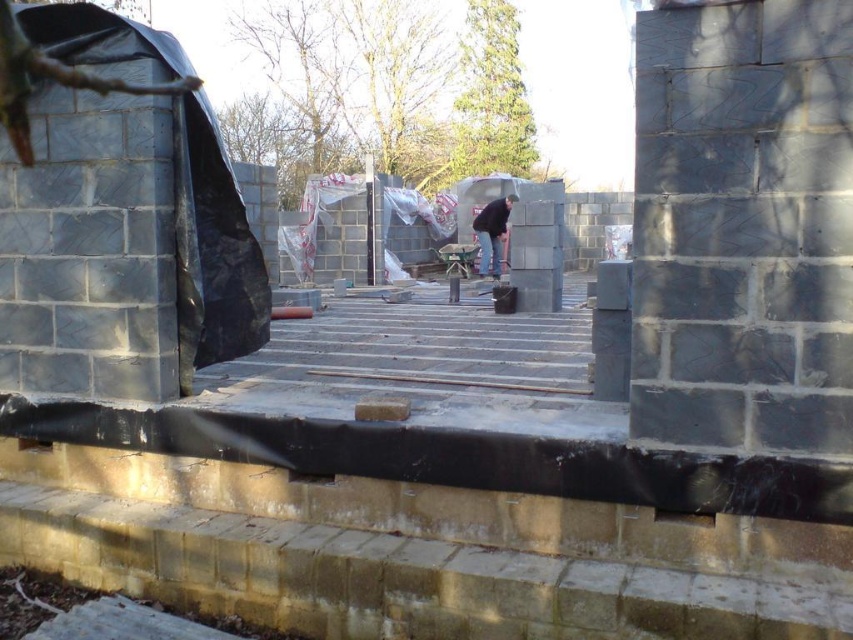
Question: Among these points, which one is farthest from the camera?

Choices:
 (A) (495, 264)
 (B) (589, 349)

Answer: (A)

Question: From the image, what is the correct spatial relationship of smooth concrete stairs at center in relation to dark gray concrete construction worker at center?

Choices:
 (A) below
 (B) above

Answer: (A)

Question: Observing the image, what is the correct spatial positioning of smooth concrete stairs at center in reference to dark gray concrete construction worker at center?

Choices:
 (A) left
 (B) right

Answer: (A)

Question: Does smooth concrete stairs at center have a smaller size compared to dark gray concrete construction worker at center?

Choices:
 (A) no
 (B) yes

Answer: (B)